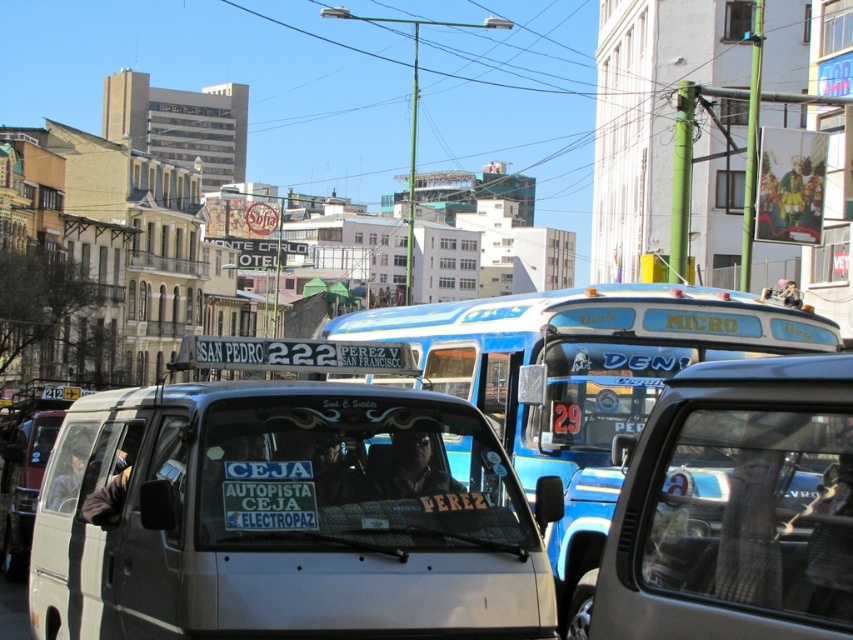
Who is more distant from viewer, (633,464) or (535,356)?

The point (535,356) is more distant.

Who is taller, metallic silver van at center or blue metallic bus at center?

metallic silver van at center

You are a GUI agent. You are given a task and a screenshot of the screen. Output one action in this format:
    pyautogui.click(x=<x>, y=<y>)
    Task: Click on the metallic silver van at center
    This screenshot has height=640, width=853.
    Given the screenshot: What is the action you would take?
    pyautogui.click(x=735, y=508)

Identify the location of metallic silver van at center. This screenshot has width=853, height=640. (735, 508).

Who is lower down, white matte van at center or metallic silver van at center?

white matte van at center is below.

Can you confirm if white matte van at center is taller than metallic silver van at center?

Correct, white matte van at center is much taller as metallic silver van at center.

Where is `white matte van at center`? white matte van at center is located at coordinates (283, 518).

Locate an element on the screen. This screenshot has height=640, width=853. white matte van at center is located at coordinates (283, 518).

Is white matte van at center thinner than blue metallic bus at center?

No, white matte van at center is not thinner than blue metallic bus at center.

Between point (209, 529) and point (445, 305), which one is positioned behind?

The point (445, 305) is behind.

This screenshot has width=853, height=640. In order to click on white matte van at center in this screenshot , I will do `click(283, 518)`.